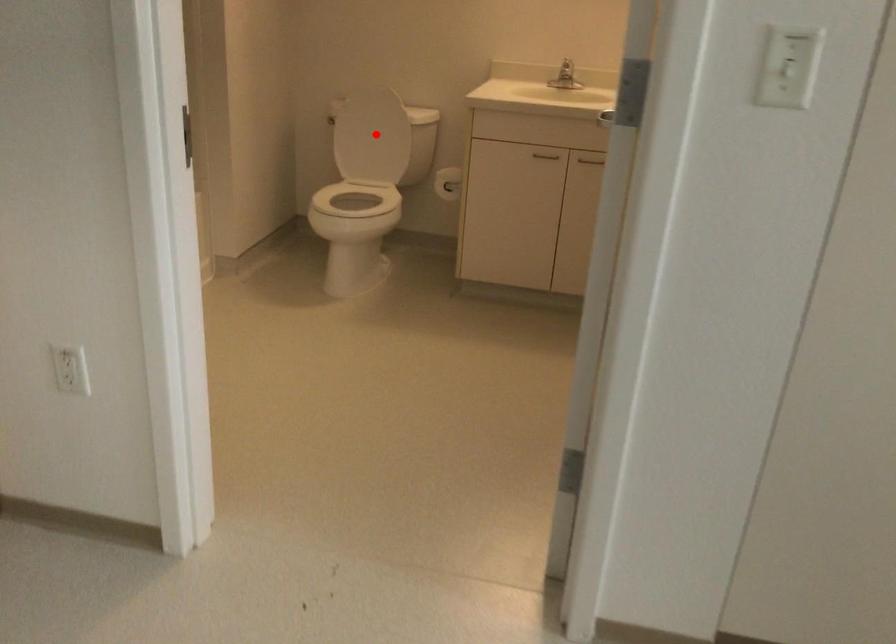
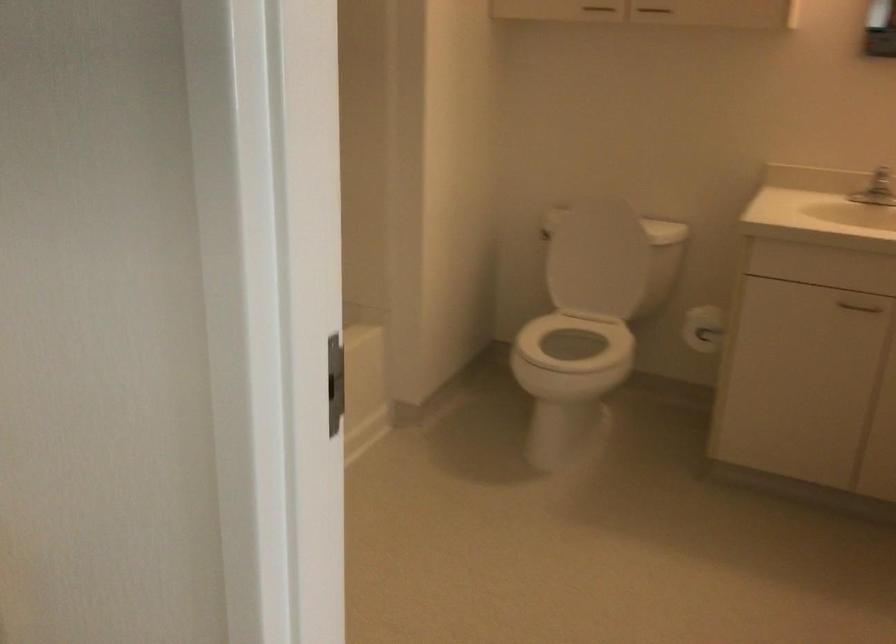
Question: I am providing you with two images of the same scene from different viewpoints. Given a red point in image1, look at the same physical point in image2. Is it:

Choices:
 (A) Closer to the viewpoint
 (B) Farther from the viewpoint

Answer: (A)